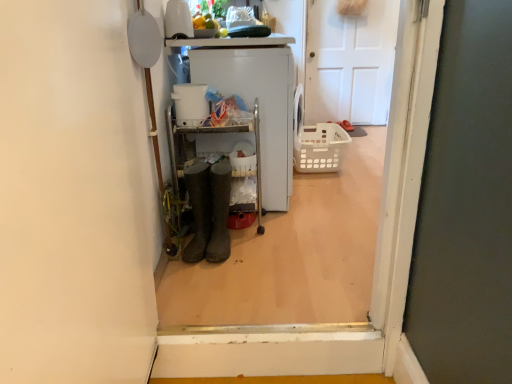
Locate an element on the screen. Image resolution: width=512 pixels, height=384 pixels. brown rubber boots at center, which appears as the 2th footwear when viewed from the left is located at coordinates (219, 212).

The width and height of the screenshot is (512, 384). What do you see at coordinates (350, 62) in the screenshot?
I see `white matte door at center` at bounding box center [350, 62].

Identify the location of translucent plastic basket at center. Image resolution: width=512 pixels, height=384 pixels. (320, 148).

Measure the distance between point (202, 252) and camera.

A distance of 1.85 meters exists between point (202, 252) and camera.

The width and height of the screenshot is (512, 384). I want to click on brown rubber boots at center, arranged as the 1th footwear when viewed from the right, so click(219, 212).

Identify the location of appliance that appears on the left of white matte door at center. The image size is (512, 384). point(259,105).

From the image's perspective, which object appears higher, white plastic washing machine at center or white matte door at center?

white matte door at center, from the image's perspective.

In the scene shown: Is translucent plastic basket at center located within brown rubber boots at center, which appears as the 2th footwear when viewed from the left?

No, translucent plastic basket at center is not inside brown rubber boots at center, which appears as the 2th footwear when viewed from the left.

Which point is more distant from viewer, (226, 191) or (346, 135)?

The point (346, 135) is more distant.

Is brown rubber boots at center, arranged as the 1th footwear when viewed from the right, at the right side of translucent plastic basket at center?

No, brown rubber boots at center, arranged as the 1th footwear when viewed from the right, is not to the right of translucent plastic basket at center.

How distant is brown rubber boots at center, arranged as the 1th footwear when viewed from the right, from translucent plastic basket at center?

They are 1.33 meters apart.

Is translucent plastic basket at center looking in the opposite direction of brown leather boots at center, the 2th footwear when ordered from right to left?

No, brown leather boots at center, the 2th footwear when ordered from right to left, is not at the back of translucent plastic basket at center.

Does translucent plastic basket at center appear on the right side of brown leather boots at center, the 2th footwear when ordered from right to left?

Yes.

Consider the image. Which is in front, translucent plastic basket at center or brown leather boots at center, the 2th footwear when ordered from right to left?

Positioned in front is brown leather boots at center, the 2th footwear when ordered from right to left.

Considering the relative sizes of translucent plastic basket at center and brown leather boots at center, arranged as the first footwear when viewed from the left, in the image provided, is translucent plastic basket at center shorter than brown leather boots at center, arranged as the first footwear when viewed from the left,?

Indeed, translucent plastic basket at center has a lesser height compared to brown leather boots at center, arranged as the first footwear when viewed from the left.

Is white matte door at center taller or shorter than brown leather boots at center, arranged as the first footwear when viewed from the left?

Considering their sizes, white matte door at center has more height than brown leather boots at center, arranged as the first footwear when viewed from the left.

From the image's perspective, between white matte door at center and brown leather boots at center, the 2th footwear when ordered from right to left, who is located below?

brown leather boots at center, the 2th footwear when ordered from right to left.

From a real-world perspective, relative to brown leather boots at center, arranged as the first footwear when viewed from the left, is white matte door at center vertically above or below?

Clearly, from a real-world perspective, white matte door at center is above brown leather boots at center, arranged as the first footwear when viewed from the left.

Considering the sizes of objects white matte door at center and brown leather boots at center, arranged as the first footwear when viewed from the left, in the image provided, who is thinner, white matte door at center or brown leather boots at center, arranged as the first footwear when viewed from the left,?

white matte door at center.

Considering the positions of objects brown rubber boots at center, arranged as the 1th footwear when viewed from the right, and white matte door at center in the image provided, who is more to the left, brown rubber boots at center, arranged as the 1th footwear when viewed from the right, or white matte door at center?

brown rubber boots at center, arranged as the 1th footwear when viewed from the right.

From the picture: Is brown rubber boots at center, which appears as the 2th footwear when viewed from the left, thinner than white matte door at center?

No, brown rubber boots at center, which appears as the 2th footwear when viewed from the left, is not thinner than white matte door at center.

Who is taller, brown rubber boots at center, which appears as the 2th footwear when viewed from the left, or white matte door at center?

With more height is white matte door at center.

Between point (221, 163) and point (345, 85), which one is positioned in front?

Positioned in front is point (221, 163).

Identify the location of basket that is on the left side of white matte door at center. The width and height of the screenshot is (512, 384). (320, 148).

From the image's perspective, is white matte door at center located above or below translucent plastic basket at center?

white matte door at center is situated higher than translucent plastic basket at center in the image.

Looking at their sizes, would you say white matte door at center is wider or thinner than translucent plastic basket at center?

white matte door at center is thinner than translucent plastic basket at center.

Consider the image. Which object is more forward, white matte door at center or translucent plastic basket at center?

Positioned in front is translucent plastic basket at center.

Is point (227, 232) farther from viewer compared to point (268, 60)?

That is False.

Which object is wider, brown rubber boots at center, arranged as the 1th footwear when viewed from the right, or white plastic washing machine at center?

Wider between the two is white plastic washing machine at center.

The height and width of the screenshot is (384, 512). What are the coordinates of `appliance behind the brown rubber boots at center, arranged as the 1th footwear when viewed from the right` in the screenshot? It's located at pyautogui.click(x=259, y=105).

Is white plastic washing machine at center inside brown rubber boots at center, which appears as the 2th footwear when viewed from the left?

No, white plastic washing machine at center is located outside of brown rubber boots at center, which appears as the 2th footwear when viewed from the left.

Locate an element on the screen. This screenshot has height=384, width=512. door above the white plastic washing machine at center (from the image's perspective) is located at coordinates (350, 62).

This screenshot has width=512, height=384. In order to click on basket lying behind the brown rubber boots at center, arranged as the 1th footwear when viewed from the right in this screenshot , I will do `click(320, 148)`.

Estimate the real-world distances between objects in this image. Which object is further from white plastic washing machine at center, white matte door at center or translucent plastic basket at center?

white matte door at center is further to white plastic washing machine at center.

Considering their positions, is translucent plastic basket at center positioned closer to brown rubber boots at center, which appears as the 2th footwear when viewed from the left, than white plastic washing machine at center?

The object closer to brown rubber boots at center, which appears as the 2th footwear when viewed from the left, is white plastic washing machine at center.

Which object lies nearer to the anchor point translucent plastic basket at center, brown leather boots at center, arranged as the first footwear when viewed from the left, or brown rubber boots at center, arranged as the 1th footwear when viewed from the right?

The object closer to translucent plastic basket at center is brown rubber boots at center, arranged as the 1th footwear when viewed from the right.

When comparing their distances from brown rubber boots at center, arranged as the 1th footwear when viewed from the right, does translucent plastic basket at center or matte rubber boots at center seem closer?

matte rubber boots at center.

From the image, which object appears to be farther from white matte door at center, white plastic washing machine at center or translucent plastic basket at center?

white plastic washing machine at center is further to white matte door at center.

Which object lies nearer to the anchor point brown rubber boots at center, which appears as the 2th footwear when viewed from the left, brown leather boots at center, the 2th footwear when ordered from right to left, or translucent plastic basket at center?

brown leather boots at center, the 2th footwear when ordered from right to left, is closer to brown rubber boots at center, which appears as the 2th footwear when viewed from the left.

Based on their spatial positions, is brown leather boots at center, arranged as the first footwear when viewed from the left, or matte rubber boots at center closer to brown rubber boots at center, which appears as the 2th footwear when viewed from the left?

The object closer to brown rubber boots at center, which appears as the 2th footwear when viewed from the left, is brown leather boots at center, arranged as the first footwear when viewed from the left.

Considering their positions, is brown rubber boots at center, which appears as the 2th footwear when viewed from the left, positioned further to white matte door at center than brown leather boots at center, the 2th footwear when ordered from right to left?

brown leather boots at center, the 2th footwear when ordered from right to left.

Locate an element on the screen. This screenshot has width=512, height=384. footwear located between brown rubber boots at center, arranged as the 1th footwear when viewed from the right, and translucent plastic basket at center in the depth direction is located at coordinates (199, 210).

The width and height of the screenshot is (512, 384). Identify the location of footwear between brown rubber boots at center, which appears as the 2th footwear when viewed from the left, and white matte door at center in the front-back direction. (199, 210).

The height and width of the screenshot is (384, 512). Identify the location of appliance between brown leather boots at center, the 2th footwear when ordered from right to left, and translucent plastic basket at center from front to back. (259, 105).

Locate an element on the screen. The height and width of the screenshot is (384, 512). appliance positioned between matte rubber boots at center and white matte door at center from near to far is located at coordinates (259, 105).